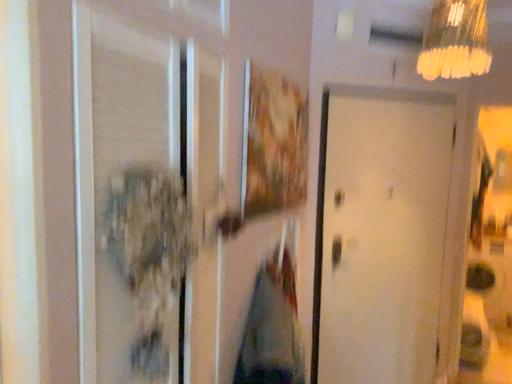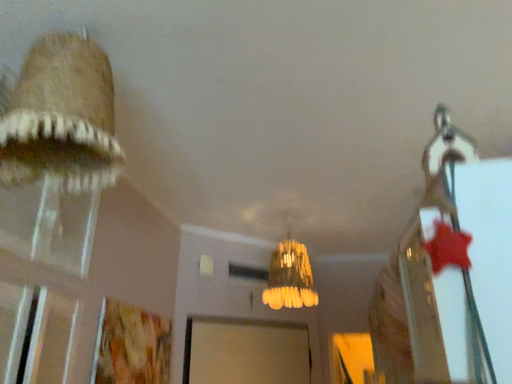
Question: Which way did the camera rotate in the video?

Choices:
 (A) rotated upward
 (B) rotated downward

Answer: (A)